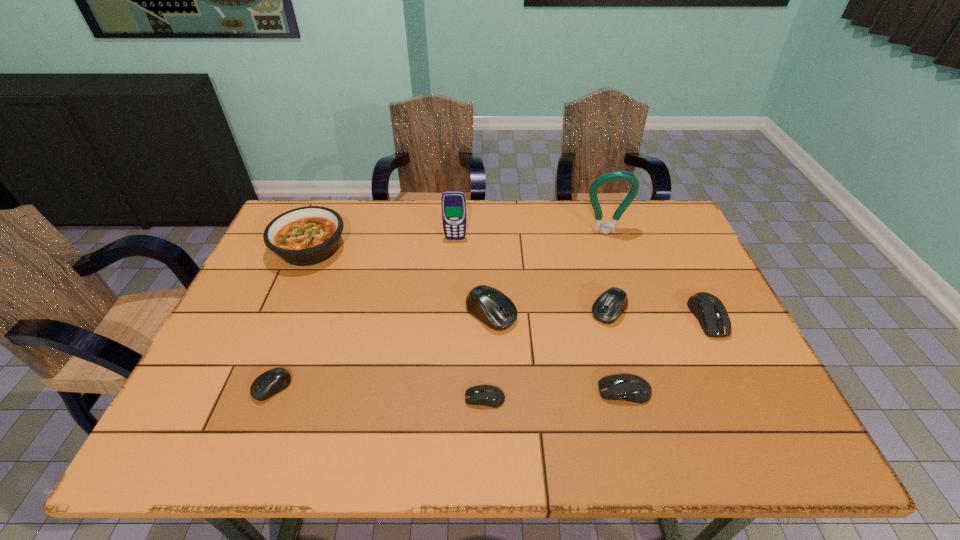
This screenshot has width=960, height=540. Identify the location of stew that is at the far edge. (304, 236).

At what (x,y) coordinates should I click in order to perform the action: click on stew present at the left edge. Please return your answer as a coordinate pair (x, y). Looking at the image, I should click on (304, 236).

Identify the location of mouse at the left edge. (271, 382).

I want to click on object that is positioned at the right edge, so click(709, 310).

At what (x,y) coordinates should I click in order to perform the action: click on object that is at the far left corner. Please return your answer as a coordinate pair (x, y). Image resolution: width=960 pixels, height=540 pixels. Looking at the image, I should click on (304, 236).

Find the location of a particular element. free space at the far edge of the desktop is located at coordinates (389, 225).

This screenshot has width=960, height=540. Find the location of `vacant space at the near edge of the desktop`. vacant space at the near edge of the desktop is located at coordinates (636, 438).

In the image, there is a desktop. Where is `vacant area at the left edge`? vacant area at the left edge is located at coordinates (294, 280).

The width and height of the screenshot is (960, 540). I want to click on vacant space at the right edge, so click(679, 289).

Find the location of a particular element. vacant space at the near left corner of the desktop is located at coordinates (234, 428).